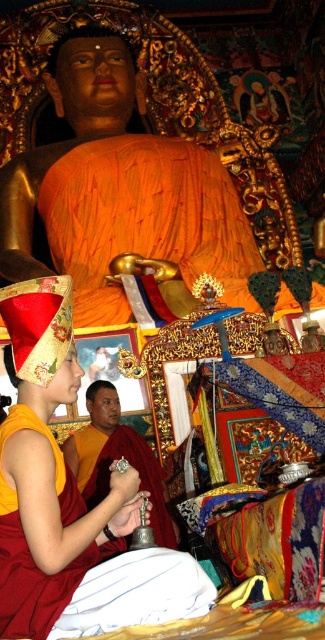
Question: Which point is closer to the camera taking this photo?

Choices:
 (A) (157, 538)
 (B) (78, 592)

Answer: (B)

Question: Is maroon silk robe at lower left to the left of smooth gold bell at center from the viewer's perspective?

Choices:
 (A) no
 (B) yes

Answer: (B)

Question: Which object appears farthest from the camera in this image?

Choices:
 (A) smooth gold bell at center
 (B) maroon silk robe at lower left

Answer: (A)

Question: Is maroon silk robe at lower left to the right of smooth gold bell at center from the viewer's perspective?

Choices:
 (A) no
 (B) yes

Answer: (A)

Question: Does maroon silk robe at lower left have a lesser width compared to smooth gold bell at center?

Choices:
 (A) yes
 (B) no

Answer: (B)

Question: Which of the following is the farthest from the observer?

Choices:
 (A) (129, 602)
 (B) (100, 397)

Answer: (B)